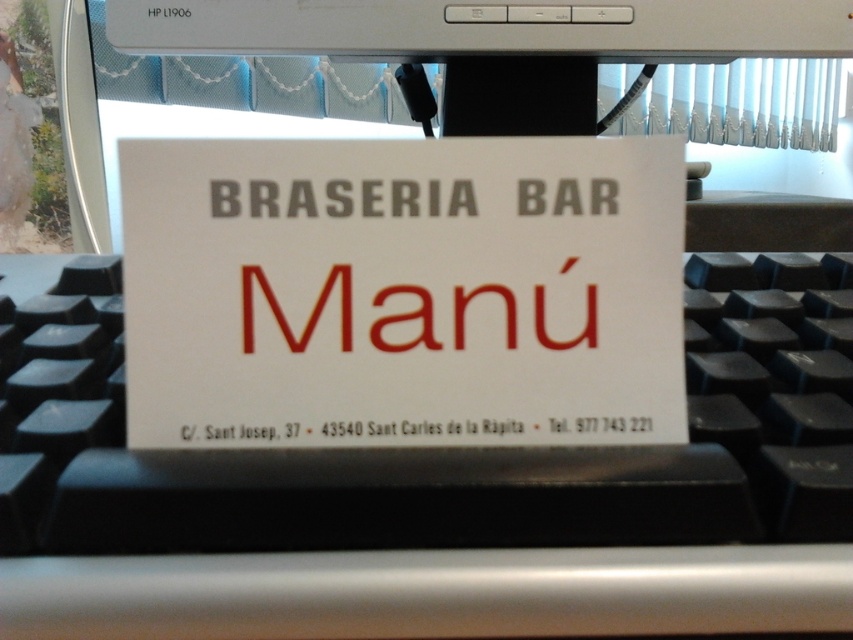
Is black plastic keyboard at center shorter than white plastic computer monitor at upper center?

Correct, black plastic keyboard at center is not as tall as white plastic computer monitor at upper center.

Who is more distant from viewer, (33,348) or (840,220)?

Point (840,220)

The height and width of the screenshot is (640, 853). What are the coordinates of `black plastic keyboard at center` in the screenshot? It's located at (447, 449).

Does white paper sign at center have a lesser height compared to white plastic computer monitor at upper center?

Correct, white paper sign at center is not as tall as white plastic computer monitor at upper center.

Can you confirm if white paper sign at center is positioned to the left of white plastic computer monitor at upper center?

In fact, white paper sign at center is to the right of white plastic computer monitor at upper center.

Is point (231, 179) behind point (461, 56)?

That is False.

The image size is (853, 640). I want to click on white paper sign at center, so click(x=402, y=291).

Is white paper sign at center positioned in front of black plastic keyboard at center?

No, it is not.

Identify the location of white paper sign at center. Image resolution: width=853 pixels, height=640 pixels. (402, 291).

What are the coordinates of `white paper sign at center` in the screenshot? It's located at (402, 291).